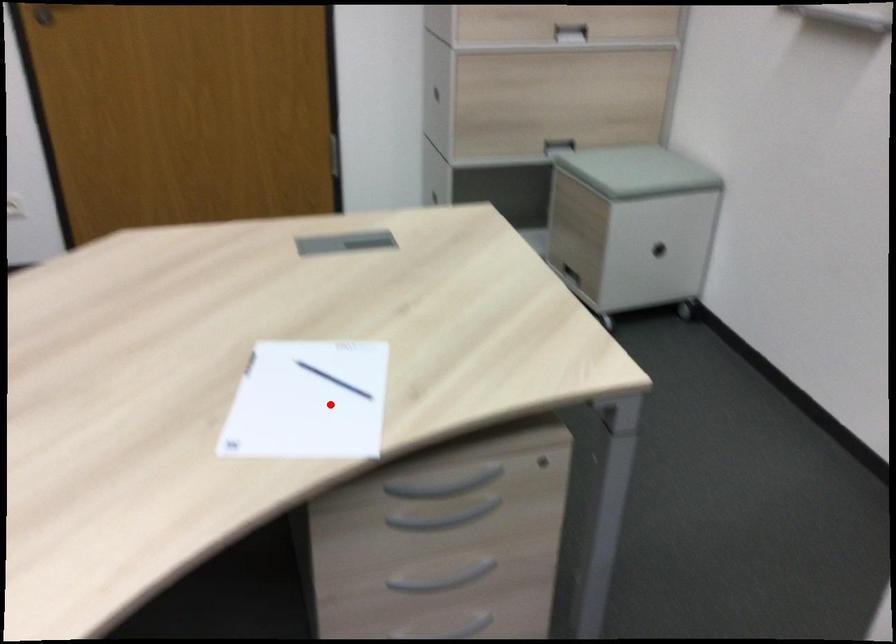
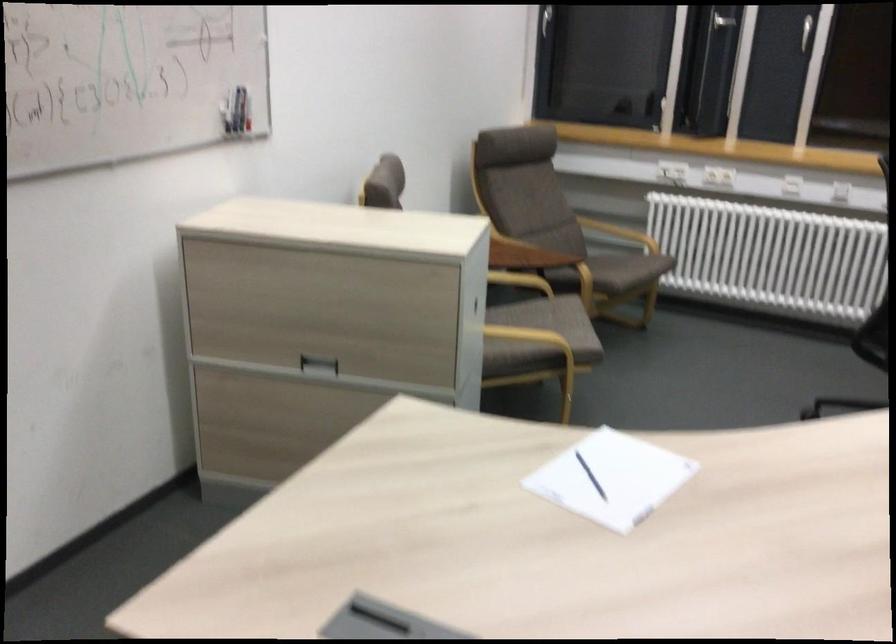
Find the pixel in the second image that matches the highlighted location in the first image.

(590, 476)